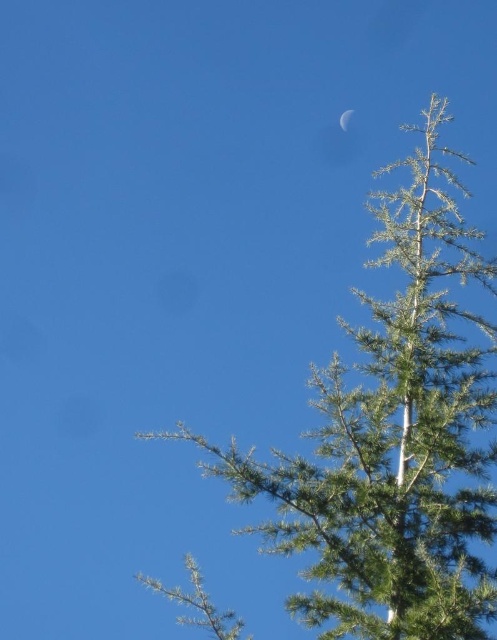
Question: Which point is farther from the camera taking this photo?

Choices:
 (A) (344, 112)
 (B) (378, 364)

Answer: (A)

Question: Which object is farther from the camera taking this photo?

Choices:
 (A) silvery reflective crescent at upper center
 (B) green needle-like tree at upper right

Answer: (A)

Question: Does green needle-like tree at upper right come in front of silvery reflective crescent at upper center?

Choices:
 (A) no
 (B) yes

Answer: (B)

Question: Is green needle-like tree at upper right positioned before silvery reflective crescent at upper center?

Choices:
 (A) no
 (B) yes

Answer: (B)

Question: Is green needle-like tree at upper right to the right of silvery reflective crescent at upper center from the viewer's perspective?

Choices:
 (A) no
 (B) yes

Answer: (B)